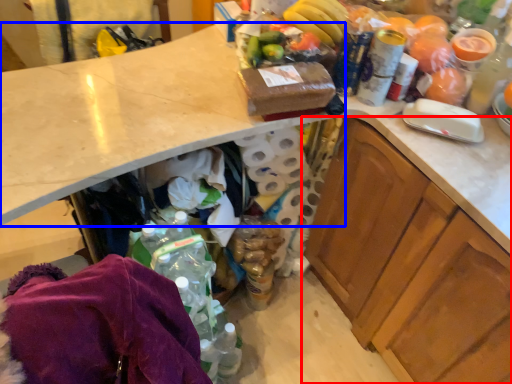
Question: Which of the following is the farthest to the observer, cabinetry (highlighted by a red box) or countertop (highlighted by a blue box)?

Choices:
 (A) cabinetry
 (B) countertop

Answer: (B)